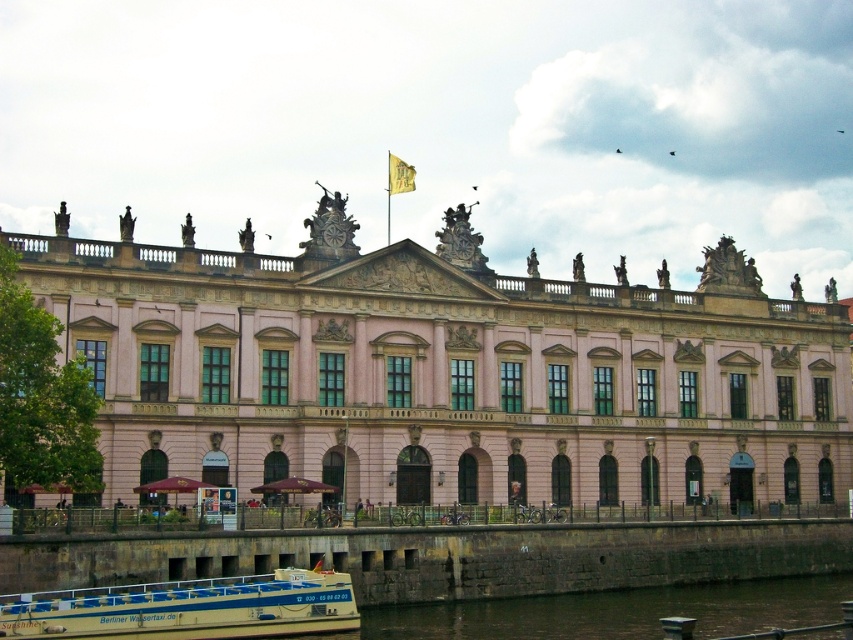
You are planning to take a photo of the white plastic boat at lower left and the yellow fabric flag at upper center. Which object should you focus on first if you want to capture both in a single frame without moving the camera? Explain your reasoning based on their sizes.

The white plastic boat at lower left is bigger than the yellow fabric flag at upper center, so focusing on the larger object first would help ensure both fit in the frame as the boat occupies more space.

You are standing in front of the grand neoclassical building and want to take a photo. You notice two points marked as point 1 at coordinates (538,369) and point 2 at coordinates (392,182). Which point is closer to your camera position?

Answer: Point 2 at coordinates (392,182) is closer to the camera position because the description states that point 1 is further away than point 2.